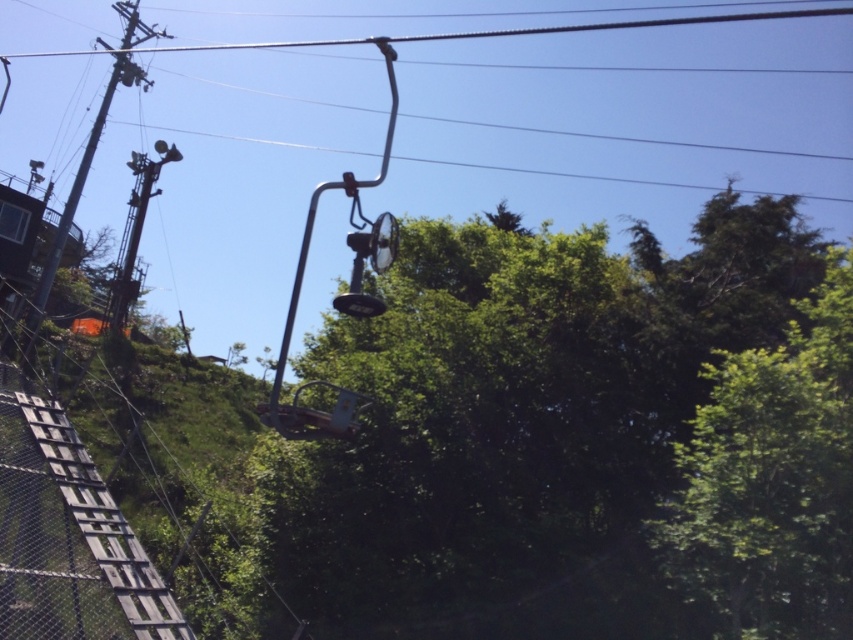
Does green leafy tree at center have a greater width compared to metallic wire at upper center?

Incorrect, green leafy tree at center's width does not surpass metallic wire at upper center's.

Is green leafy tree at center shorter than metallic wire at upper center?

No.

Is point (350, 321) closer to camera compared to point (688, 20)?

Yes.

This screenshot has height=640, width=853. I want to click on green leafy tree at center, so tap(518, 424).

Can you confirm if green leafy tree at center is positioned above green leafy tree at upper right?

Indeed, green leafy tree at center is positioned over green leafy tree at upper right.

Consider the image. How much distance is there between green leafy tree at center and green leafy tree at upper right?

green leafy tree at center and green leafy tree at upper right are 9.09 feet apart.

You are a GUI agent. You are given a task and a screenshot of the screen. Output one action in this format:
    pyautogui.click(x=<x>, y=<y>)
    Task: Click on the green leafy tree at center
    Image resolution: width=853 pixels, height=640 pixels.
    Given the screenshot: What is the action you would take?
    pyautogui.click(x=518, y=424)

Does green leafy tree at upper right have a lesser width compared to metallic wire at upper center?

Indeed, green leafy tree at upper right has a lesser width compared to metallic wire at upper center.

Does green leafy tree at upper right have a greater height compared to metallic wire at upper center?

Incorrect, green leafy tree at upper right's height is not larger of metallic wire at upper center's.

At what (x,y) coordinates should I click in order to perform the action: click on green leafy tree at upper right. Please return your answer as a coordinate pair (x, y). This screenshot has height=640, width=853. Looking at the image, I should click on (772, 477).

What are the coordinates of `green leafy tree at upper right` in the screenshot? It's located at (772, 477).